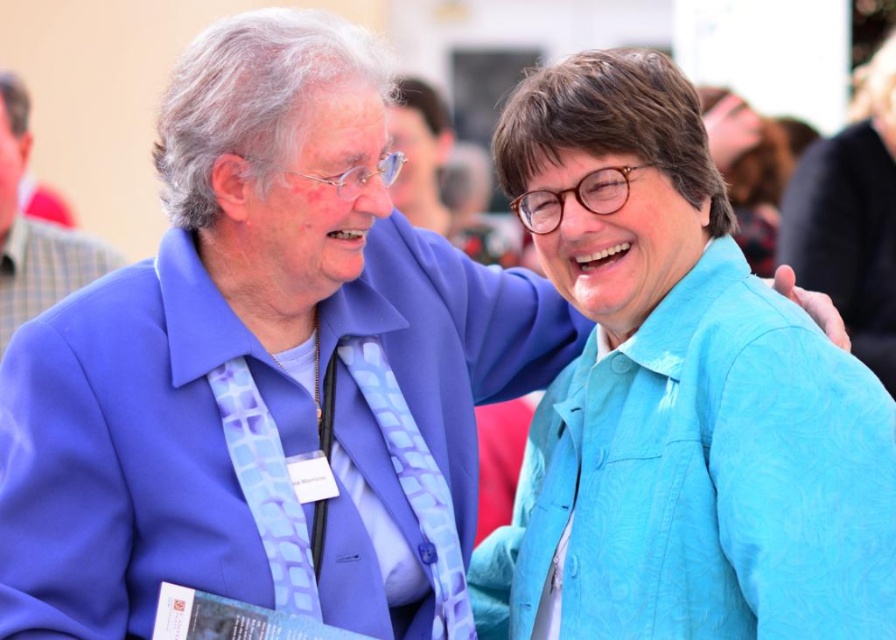
Which is more to the right, turquoise fabric shirt at right or matte blue suit at left?

Positioned to the right is turquoise fabric shirt at right.

How far apart are turquoise fabric shirt at right and matte blue suit at left?

7.96 meters

This screenshot has height=640, width=896. What are the coordinates of `turquoise fabric shirt at right` in the screenshot? It's located at (676, 397).

Which is more to the right, blue fabric shirt at right or matte blue suit at left?

blue fabric shirt at right is more to the right.

Between blue fabric shirt at right and matte blue suit at left, which one has less height?

matte blue suit at left is shorter.

Locate an element on the screen. This screenshot has height=640, width=896. blue fabric shirt at right is located at coordinates (851, 220).

Is turquoise fabric shirt at right above blue fabric shirt at right?

No, turquoise fabric shirt at right is not above blue fabric shirt at right.

Who is lower down, turquoise fabric shirt at right or blue fabric shirt at right?

turquoise fabric shirt at right is lower down.

Locate an element on the screen. turquoise fabric shirt at right is located at coordinates (676, 397).